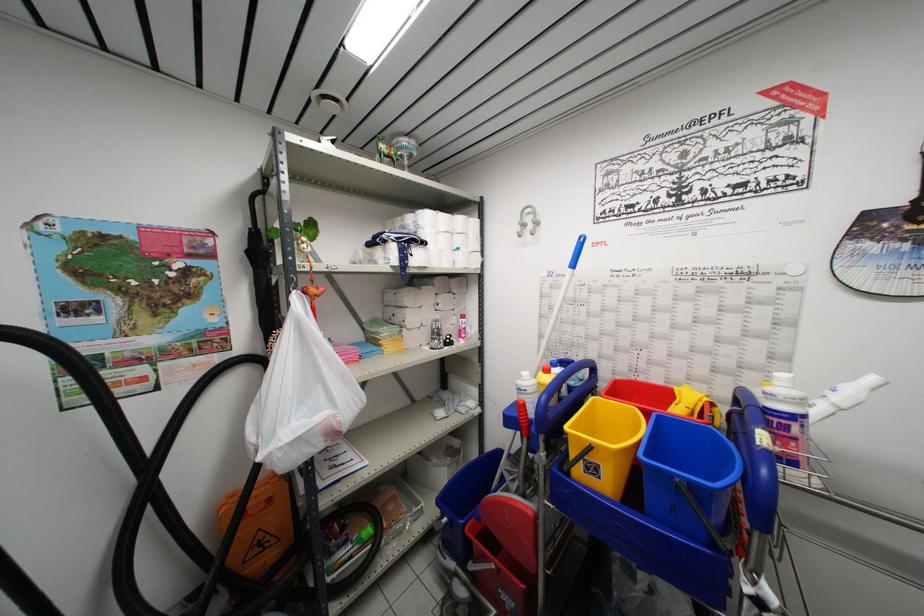
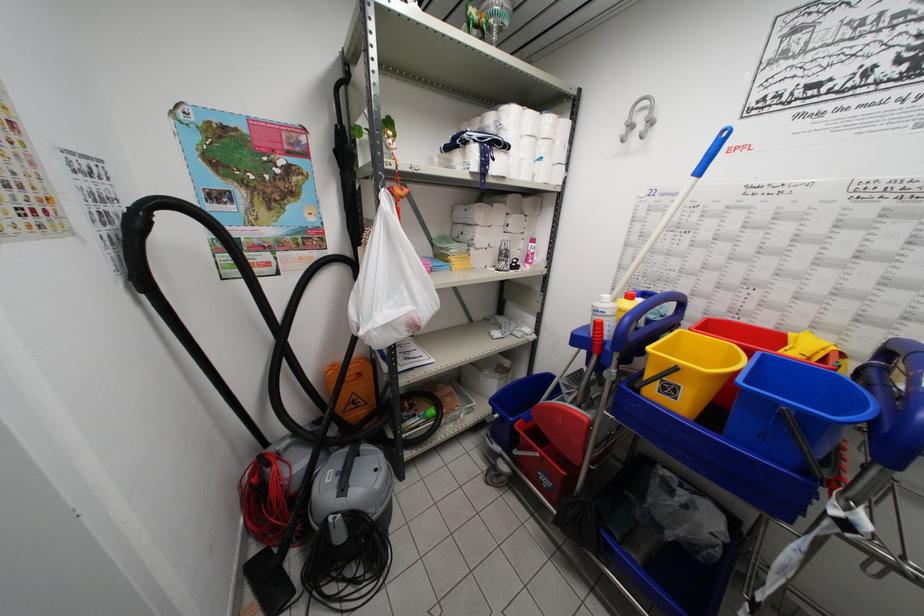
Question: The first image is from the beginning of the video and the second image is from the end. How did the camera likely rotate when shooting the video?

Choices:
 (A) Left
 (B) Right
 (C) Up
 (D) Down

Answer: (D)